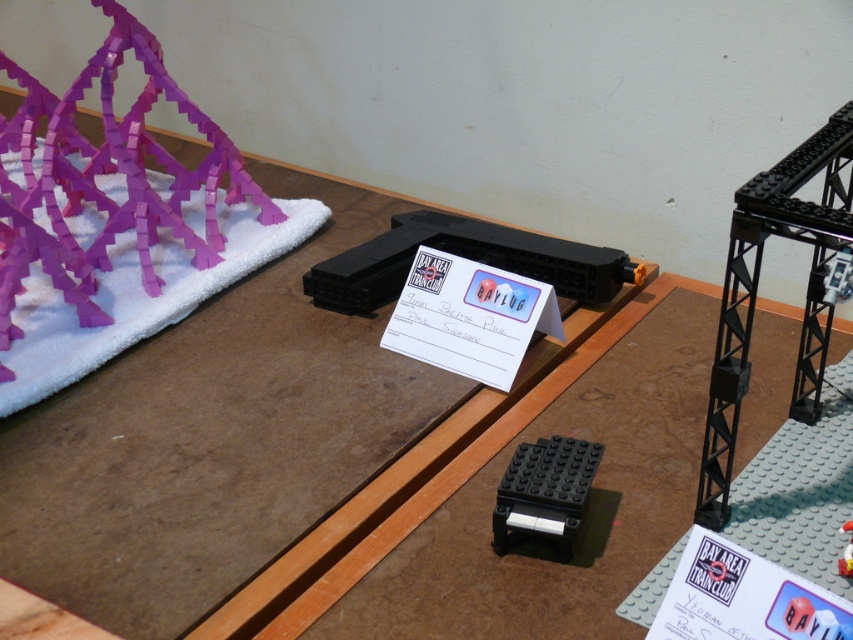
Question: Which point is farther to the camera?

Choices:
 (A) white glossy toy at center
 (B) black plastic train car at center
 (C) black matte platform at center
 (D) purple plastic structure at upper left

Answer: (B)

Question: Observing the image, what is the correct spatial positioning of purple plastic structure at upper left in reference to black matte platform at center?

Choices:
 (A) right
 (B) left

Answer: (B)

Question: Which of the following is the closest to the observer?

Choices:
 (A) (405, 221)
 (B) (838, 570)
 (C) (543, 456)

Answer: (B)

Question: Does purple plastic structure at upper left appear on the right side of black matte platform at center?

Choices:
 (A) no
 (B) yes

Answer: (A)

Question: Is purple plastic structure at upper left to the left of white glossy toy at center from the viewer's perspective?

Choices:
 (A) yes
 (B) no

Answer: (A)

Question: Which point is closer to the camera?

Choices:
 (A) (849, 540)
 (B) (6, 225)
 (C) (407, 241)

Answer: (A)